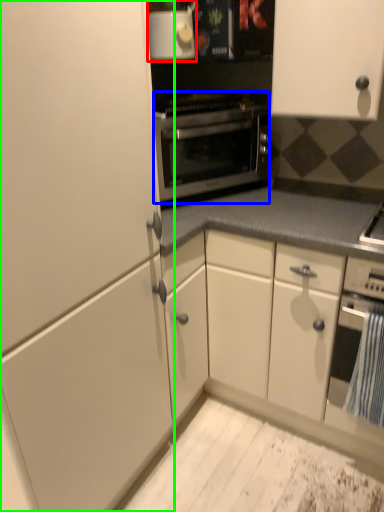
Question: Estimate the real-world distances between objects in this image. Which object is closer to appliance (highlighted by a red box), oven (highlighted by a blue box) or cabinetry (highlighted by a green box)?

Choices:
 (A) oven
 (B) cabinetry

Answer: (A)